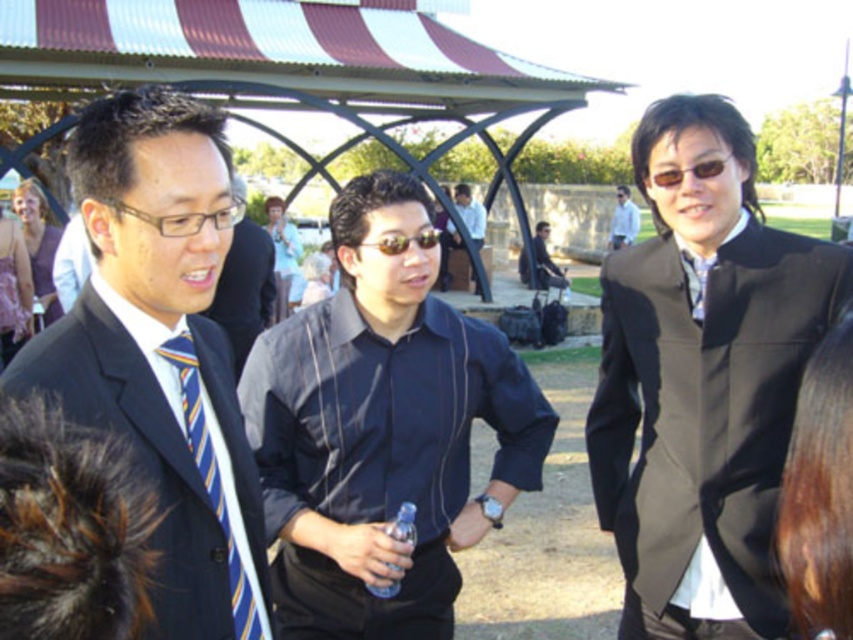
You are organizing a charity event and need to decide which outfit to recommend for a speaker. The speaker prefers a more formal look but also wants something slimming. Based on the description of the black satin suit at center and the dark blue striped shirt at center, which option would you suggest?

The black satin suit at center is thinner than the dark blue striped shirt at center, so the black satin suit at center would be the better choice for a slimming and formal look.

You are a photographer at this event. You need to take a photo of both the dark blue striped shirt at center and the striped silk tie at left. Which one is positioned higher in the frame?

The dark blue striped shirt at center is located above the striped silk tie at left, so it is positioned higher in the frame.